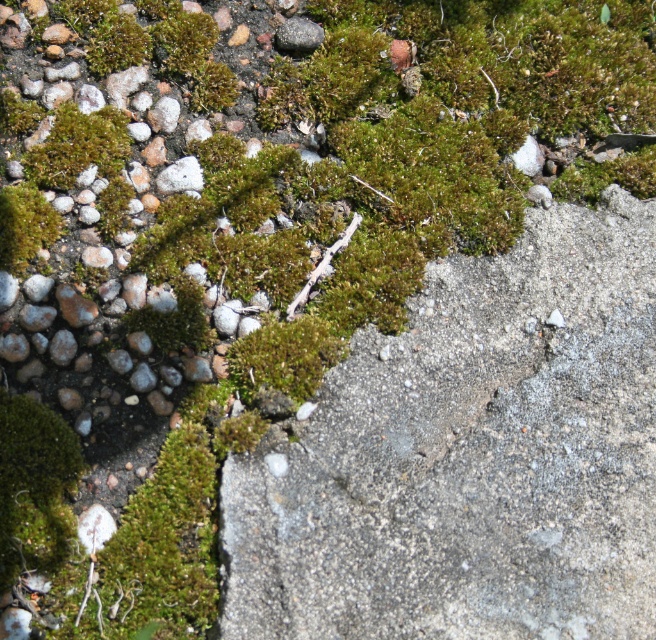
Question: Where is gray concrete at center located in relation to green mossy patch at upper left in the image?

Choices:
 (A) left
 (B) right

Answer: (B)

Question: Is gray concrete at center in front of green mossy patch at upper left?

Choices:
 (A) no
 (B) yes

Answer: (B)

Question: Which point is farther to the camera?

Choices:
 (A) click(x=100, y=138)
 (B) click(x=642, y=636)

Answer: (A)

Question: Which point is closer to the camera?

Choices:
 (A) gray concrete at center
 (B) green mossy patch at upper left

Answer: (A)

Question: Is gray concrete at center further to camera compared to green mossy patch at upper left?

Choices:
 (A) yes
 (B) no

Answer: (B)

Question: Which point is closer to the camera?

Choices:
 (A) pos(98,150)
 (B) pos(447,289)

Answer: (B)